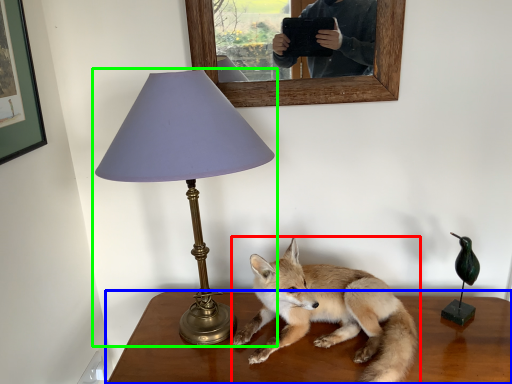
Question: Estimate the real-world distances between objects in this image. Which object is farther from fox (highlighted by a red box), table (highlighted by a blue box) or lamp (highlighted by a green box)?

Choices:
 (A) table
 (B) lamp

Answer: (B)